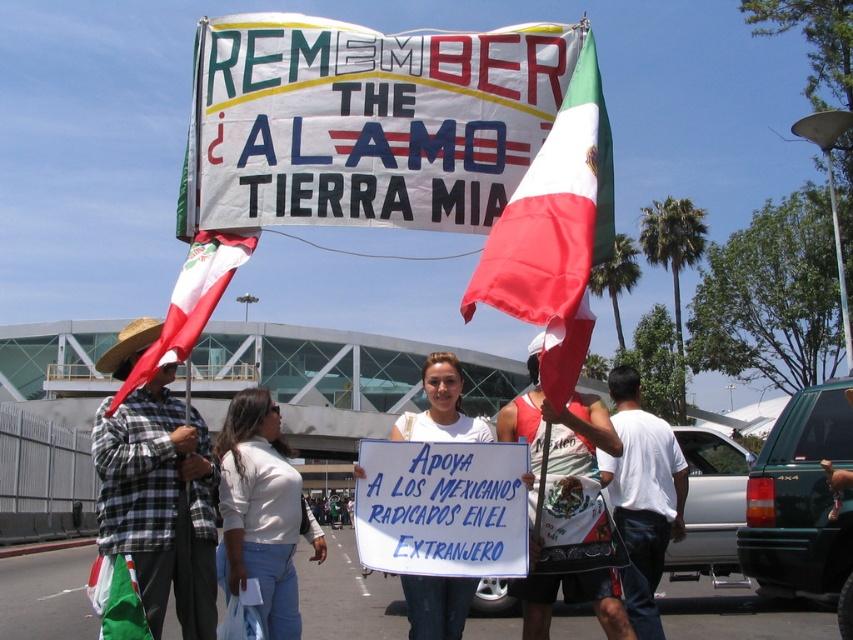
Is red fabric flag at center behind white cotton shirt at lower right?

No.

Which of these two, red fabric flag at center or white cotton shirt at lower right, stands taller?

red fabric flag at center

Does point (613, 449) come in front of point (631, 518)?

Yes, point (613, 449) is closer to viewer.

Find the location of a particular element. The image size is (853, 640). red fabric flag at center is located at coordinates (567, 508).

Is white fabric flag at center to the right of red fabric flag at center from the viewer's perspective?

No, white fabric flag at center is not to the right of red fabric flag at center.

Locate an element on the screen. This screenshot has width=853, height=640. white fabric flag at center is located at coordinates (555, 232).

This screenshot has width=853, height=640. I want to click on white fabric flag at center, so click(x=555, y=232).

Is red fabric flag at center below red and white striped flag at left?

Indeed, red fabric flag at center is positioned under red and white striped flag at left.

Is red fabric flag at center positioned in front of red and white striped flag at left?

That is True.

Which is behind, point (531, 408) or point (154, 356)?

The point (531, 408) is behind.

You are a GUI agent. You are given a task and a screenshot of the screen. Output one action in this format:
    pyautogui.click(x=<x>, y=<y>)
    Task: Click on the red fabric flag at center
    
    Given the screenshot: What is the action you would take?
    pyautogui.click(x=567, y=508)